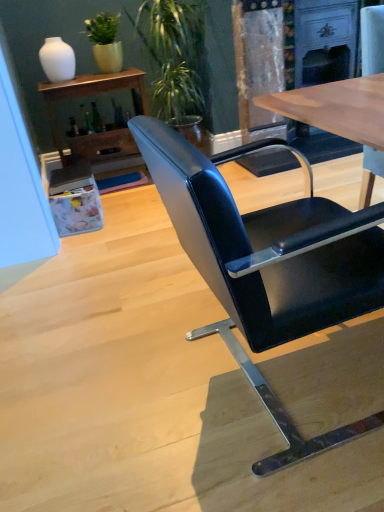
Locate an element on the screen. free space in front of matte wood shelf at upper left is located at coordinates (127, 205).